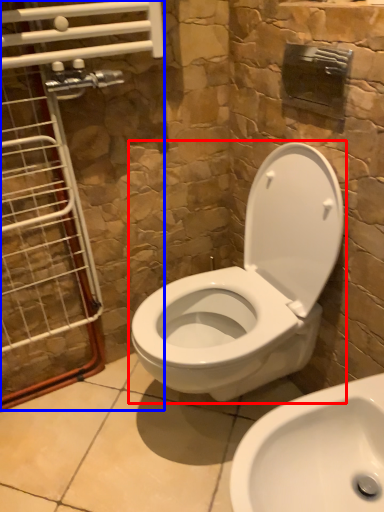
Question: Which object appears closest to the camera in this image, toilet (highlighted by a red box) or glass door (highlighted by a blue box)?

Choices:
 (A) toilet
 (B) glass door

Answer: (A)